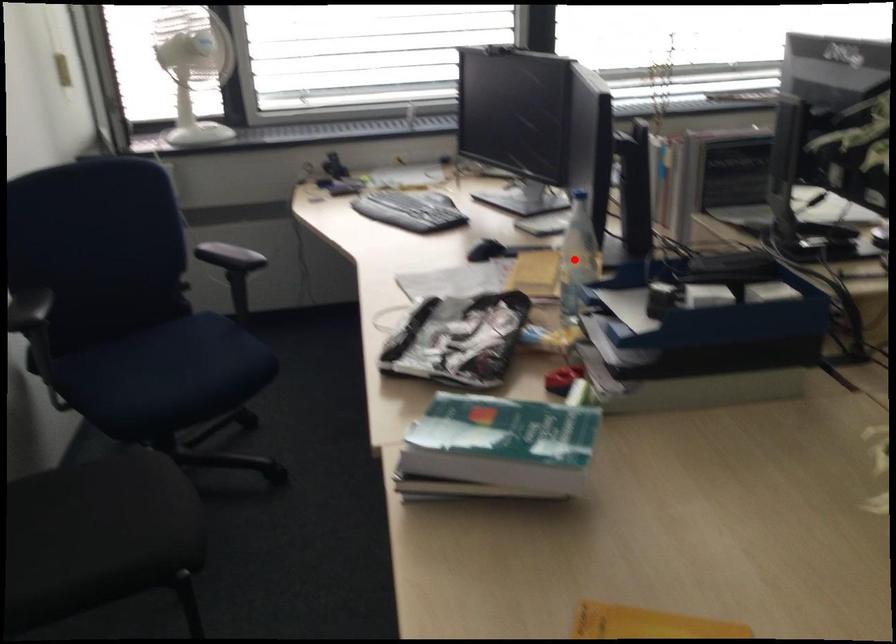
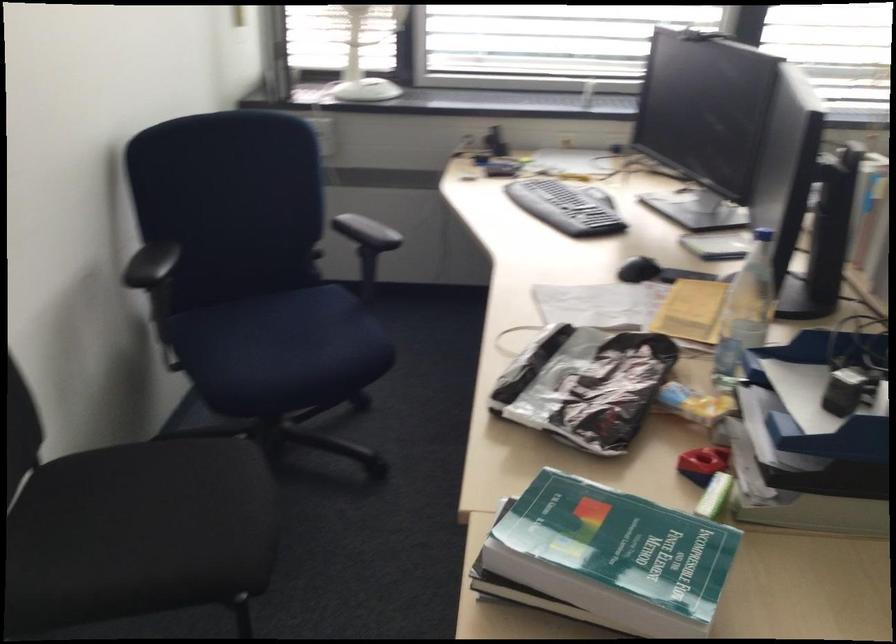
Question: I am providing you with two images of the same scene from different viewpoints. Given a red point in image1, look at the same physical point in image2. Is it:

Choices:
 (A) Closer to the viewpoint
 (B) Farther from the viewpoint

Answer: (A)